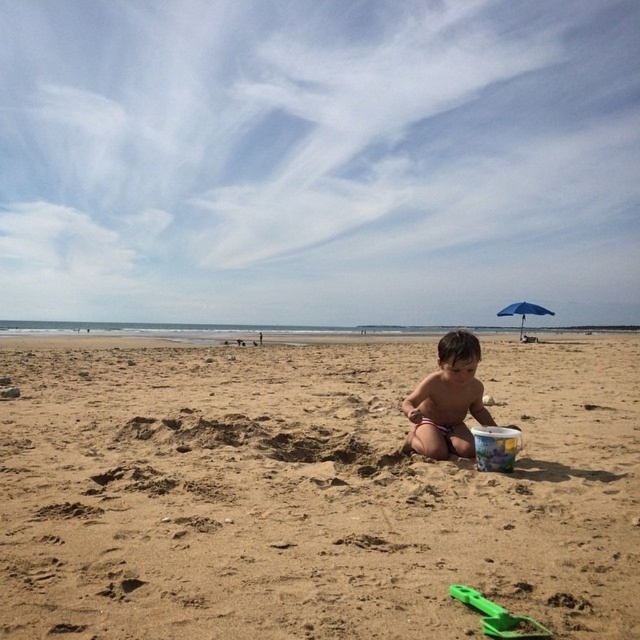
You are a parent at the beach and want to ensure your child stays shaded. The smooth skin child at center is sitting in the sand. Is the blue fabric umbrella at upper right providing shade for them?

Yes, the smooth skin child at center is positioned under the blue fabric umbrella at upper right, so the umbrella is providing shade for them.

You are standing at the camera position and want to take a photo of the smooth skin child at center. If your camera has a maximum focus range of 5 meters, will you be able to capture the child in focus?

The smooth skin child at center and camera are 5.15 meters apart from each other. Since the distance exceeds the camera maximum focus range of 5 meters, the child will be out of focus.